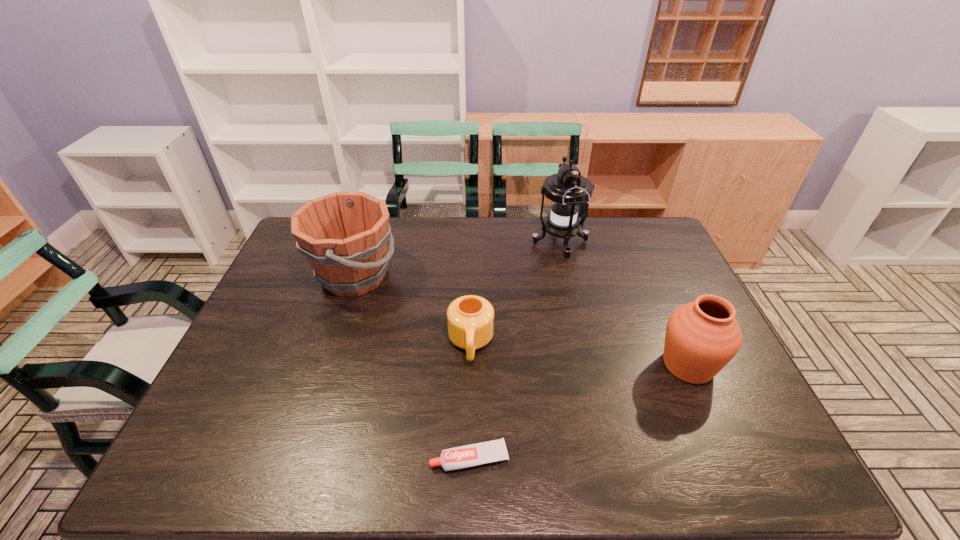
You are a GUI agent. You are given a task and a screenshot of the screen. Output one action in this format:
    pyautogui.click(x=<x>, y=<y>)
    Task: Click on the free space between the tallest object and the mug
    Image resolution: width=960 pixels, height=540 pixels.
    Given the screenshot: What is the action you would take?
    pyautogui.click(x=516, y=293)

This screenshot has width=960, height=540. I want to click on free space that is in between the tallest object and the urn, so point(624,304).

Where is `vacant region between the mug and the bucket`? The height and width of the screenshot is (540, 960). vacant region between the mug and the bucket is located at coordinates (413, 309).

At what (x,y) coordinates should I click in order to perform the action: click on empty space between the fourth tallest object and the toothpaste. Please return your answer as a coordinate pair (x, y). Looking at the image, I should click on (470, 401).

Identify which object is the fourth nearest to the fourth object from left to right. Please provide its 2D coordinates. Your answer should be formatted as a tuple, i.e. [(x, y)], where the tuple contains the x and y coordinates of a point satisfying the conditions above.

[(471, 455)]

Select which object is the fourth closest to the second shortest object. Please provide its 2D coordinates. Your answer should be formatted as a tuple, i.e. [(x, y)], where the tuple contains the x and y coordinates of a point satisfying the conditions above.

[(702, 337)]

The width and height of the screenshot is (960, 540). I want to click on vacant area that satisfies the following two spatial constraints: 1. on the handle side of the urn; 2. on the left side of the fourth tallest object, so click(470, 365).

Where is `free space that satisfies the following two spatial constraints: 1. on the handle side of the fourth tallest object; 2. on the right side of the shortest object`? Image resolution: width=960 pixels, height=540 pixels. free space that satisfies the following two spatial constraints: 1. on the handle side of the fourth tallest object; 2. on the right side of the shortest object is located at coordinates (468, 458).

The image size is (960, 540). What are the coordinates of `free space that satisfies the following two spatial constraints: 1. on the back side of the shortest object; 2. on the handle side of the bucket` in the screenshot? It's located at (472, 276).

This screenshot has height=540, width=960. Find the location of `vacant area that satisfies the following two spatial constraints: 1. on the handle side of the leftmost object; 2. on the left side of the shortest object`. vacant area that satisfies the following two spatial constraints: 1. on the handle side of the leftmost object; 2. on the left side of the shortest object is located at coordinates (295, 458).